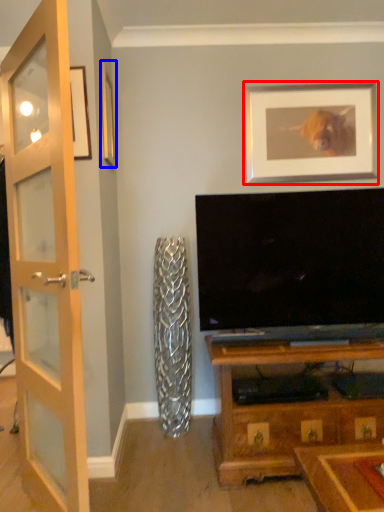
Question: Which object is further to the camera taking this photo, picture frame (highlighted by a red box) or picture frame (highlighted by a blue box)?

Choices:
 (A) picture frame
 (B) picture frame

Answer: (A)